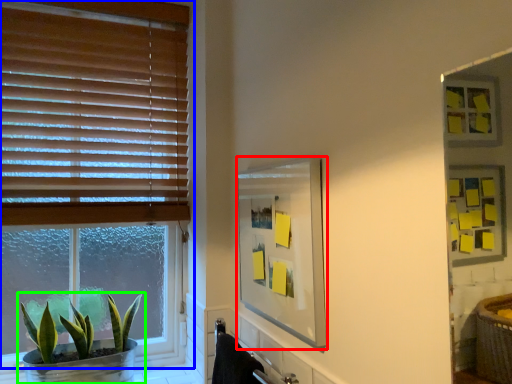
Question: Which object is positioned closest to mirror (highlighted by a red box)? Select from window (highlighted by a blue box) and houseplant (highlighted by a green box).

Choices:
 (A) window
 (B) houseplant

Answer: (A)